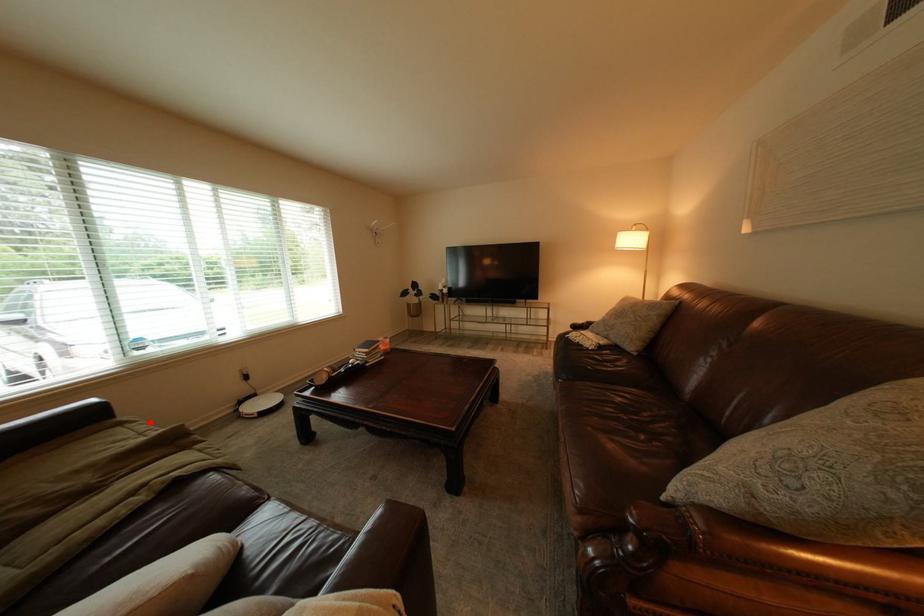
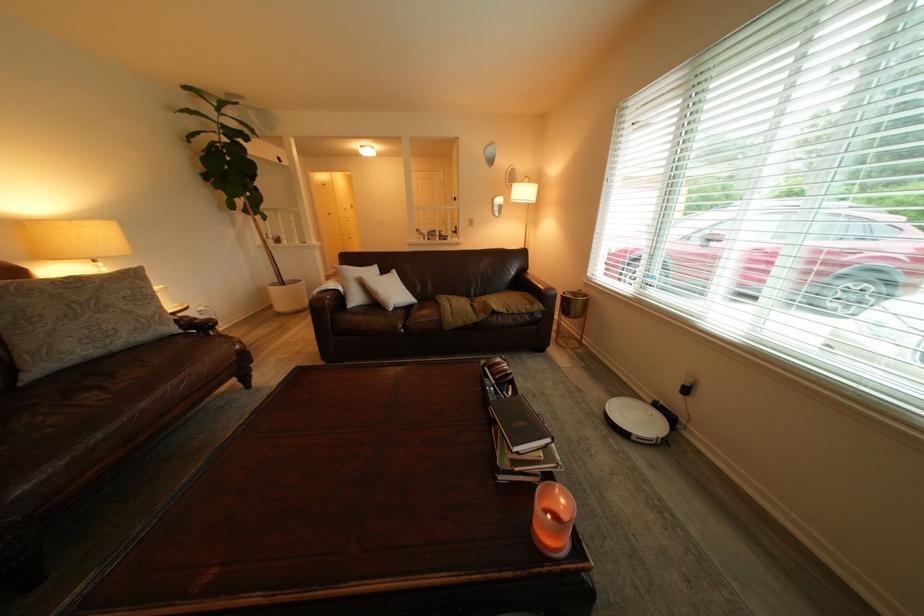
Find the pixel in the second image that matches the highlighted location in the first image.

(546, 309)